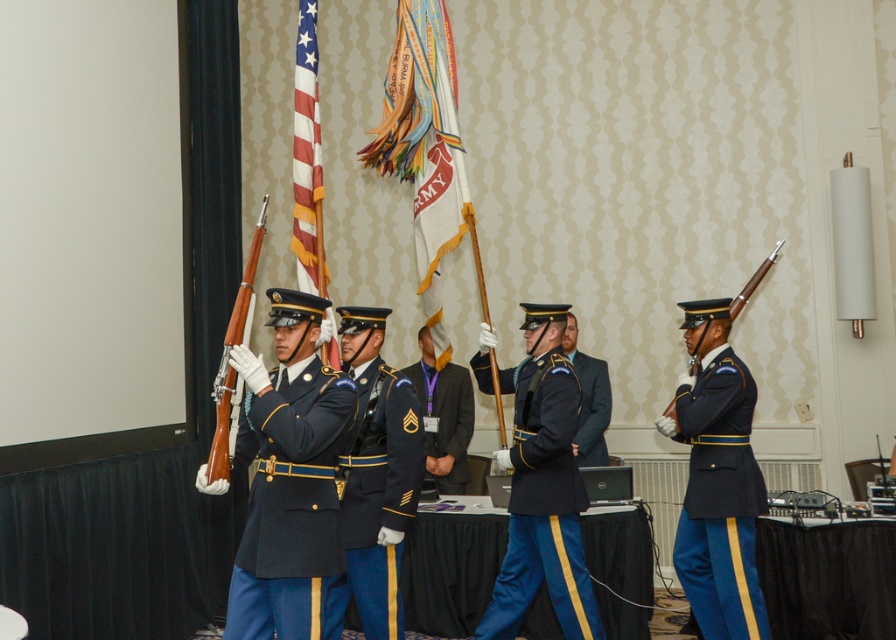
Question: Can you confirm if navy blue fabric uniform at center is wider than shiny brown rifle at right?

Choices:
 (A) no
 (B) yes

Answer: (A)

Question: Among these points, which one is nearest to the camera?

Choices:
 (A) (261, 492)
 (B) (592, 420)

Answer: (A)

Question: Considering the real-world distances, which object is farthest from the american flag at center?

Choices:
 (A) shiny blue fabric uniform at right
 (B) shiny blue uniform at center

Answer: (A)

Question: Can you confirm if shiny blue fabric uniform at center is bigger than shiny dark blue uniform at center?

Choices:
 (A) yes
 (B) no

Answer: (A)

Question: Which object is farther from the camera taking this photo?

Choices:
 (A) shiny blue fabric uniform at right
 (B) dark blue fabric uniform at center

Answer: (B)

Question: Is american flag at center to the right of shiny dark blue uniform at center from the viewer's perspective?

Choices:
 (A) yes
 (B) no

Answer: (B)